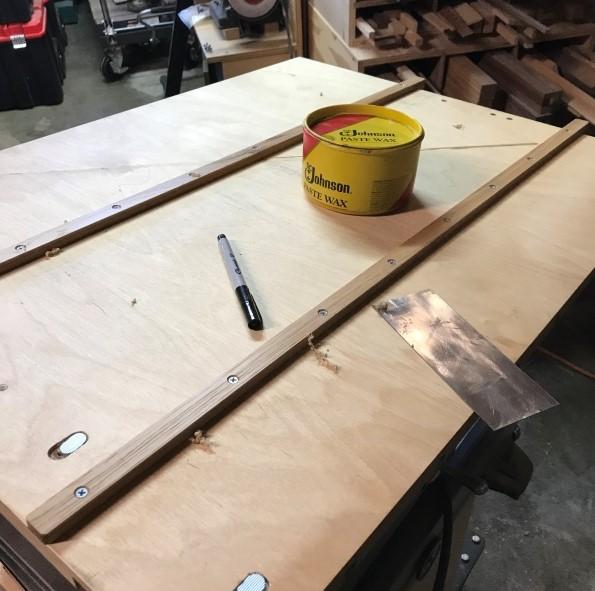
At what (x,y) coordinates should I click in order to perform the action: click on sheet of paper. Please return your answer as a coordinate pair (x, y). The width and height of the screenshot is (595, 591). Looking at the image, I should click on (501, 412).